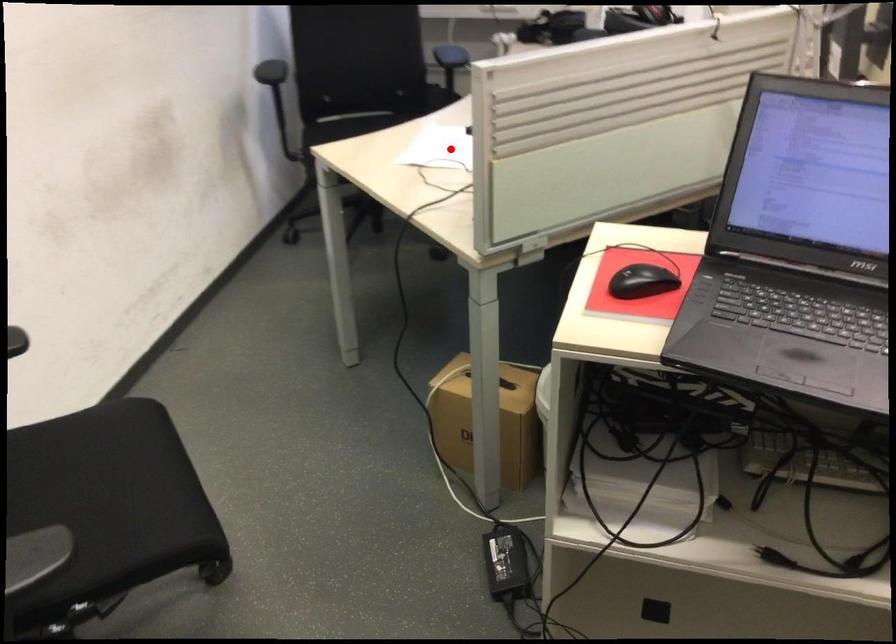
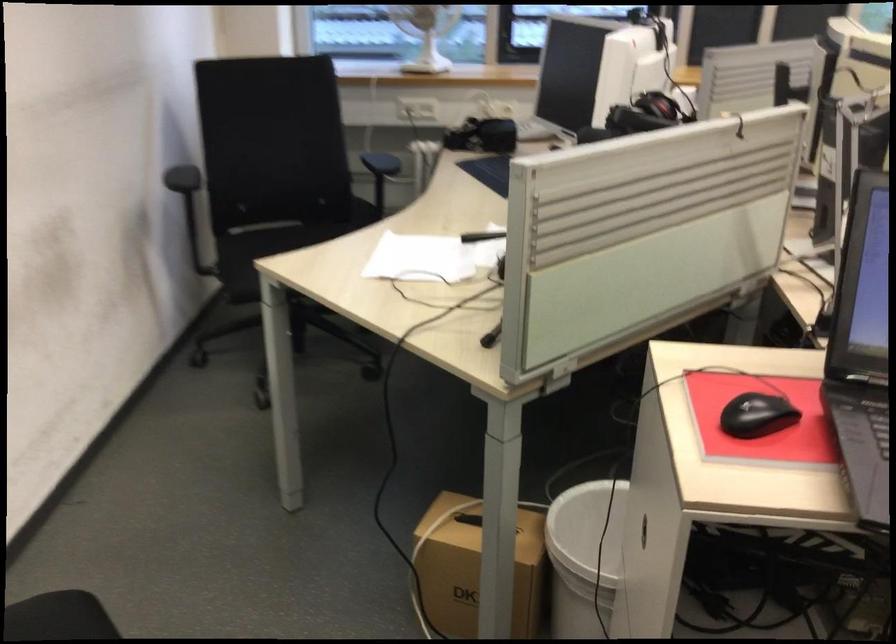
Question: I am providing you with two images of the same scene from different viewpoints. A red point is shown in image1. For the corresponding object point in image2, is it positioned nearer or farther from the camera?

Choices:
 (A) Nearer
 (B) Farther

Answer: (A)